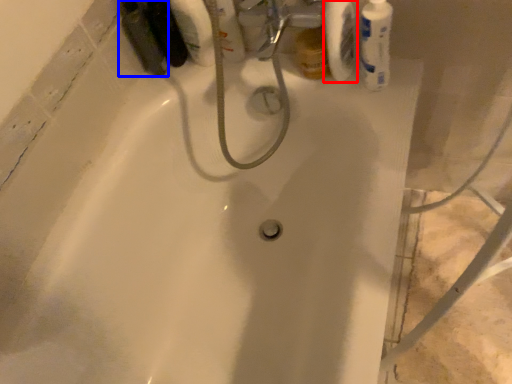
Question: Among these objects, which one is farthest to the camera, toilet paper (highlighted by a red box) or mouthwash (highlighted by a blue box)?

Choices:
 (A) toilet paper
 (B) mouthwash

Answer: (B)